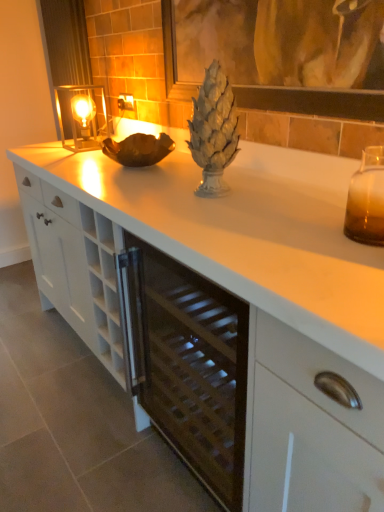
Question: Are amber glass vase at right, placed as the 2th candle holder when sorted from left to right, and metallic silver curtain at upper left far apart?

Choices:
 (A) no
 (B) yes

Answer: (B)

Question: Does amber glass vase at right, placed as the 2th candle holder when sorted from left to right, appear on the right side of metallic silver curtain at upper left?

Choices:
 (A) yes
 (B) no

Answer: (A)

Question: From the image's perspective, is amber glass vase at right, placed as the 2th candle holder when sorted from left to right, beneath metallic silver curtain at upper left?

Choices:
 (A) no
 (B) yes

Answer: (B)

Question: Considering the relative sizes of amber glass vase at right, placed as the 2th candle holder when sorted from left to right, and metallic silver curtain at upper left in the image provided, is amber glass vase at right, placed as the 2th candle holder when sorted from left to right, wider than metallic silver curtain at upper left?

Choices:
 (A) no
 (B) yes

Answer: (B)

Question: Is amber glass vase at right, which appears as the 2th candle holder when viewed from the top, aimed at metallic silver curtain at upper left?

Choices:
 (A) no
 (B) yes

Answer: (A)

Question: Is amber glass vase at right, placed as the first candle holder when sorted from right to left, bigger than metallic silver curtain at upper left?

Choices:
 (A) no
 (B) yes

Answer: (A)

Question: Can you confirm if amber glass vase at right, placed as the 2th candle holder when sorted from left to right, is bigger than white matte countertop at center?

Choices:
 (A) no
 (B) yes

Answer: (A)

Question: Is the position of amber glass vase at right, which appears as the 2th candle holder when viewed from the top, less distant than that of white matte countertop at center?

Choices:
 (A) no
 (B) yes

Answer: (B)

Question: From a real-world perspective, is amber glass vase at right, which is the second candle holder from back to front, physically above white matte countertop at center?

Choices:
 (A) yes
 (B) no

Answer: (A)

Question: Is amber glass vase at right, the 1th candle holder positioned from the front, further to camera compared to white matte countertop at center?

Choices:
 (A) no
 (B) yes

Answer: (A)

Question: Is amber glass vase at right, which is the second candle holder from back to front, wider than white matte countertop at center?

Choices:
 (A) yes
 (B) no

Answer: (B)

Question: Can you confirm if amber glass vase at right, the 1th candle holder in the bottom-to-top sequence, is positioned to the left of white matte countertop at center?

Choices:
 (A) no
 (B) yes

Answer: (A)

Question: Considering the relative sizes of metallic glass candle holder at left, which ranks as the 2th candle holder in right-to-left order, and shiny metallic pineapple at center in the image provided, is metallic glass candle holder at left, which ranks as the 2th candle holder in right-to-left order, taller than shiny metallic pineapple at center?

Choices:
 (A) yes
 (B) no

Answer: (B)